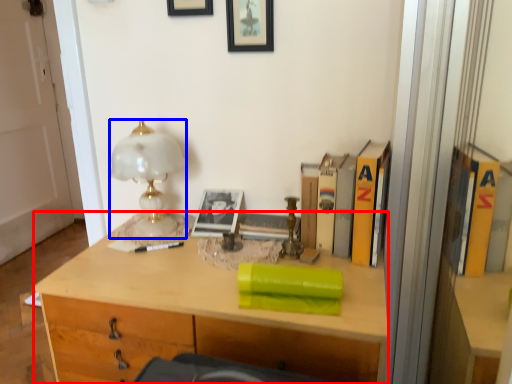
Question: Which point is further to the camera, desk (highlighted by a red box) or lamp (highlighted by a blue box)?

Choices:
 (A) desk
 (B) lamp

Answer: (B)